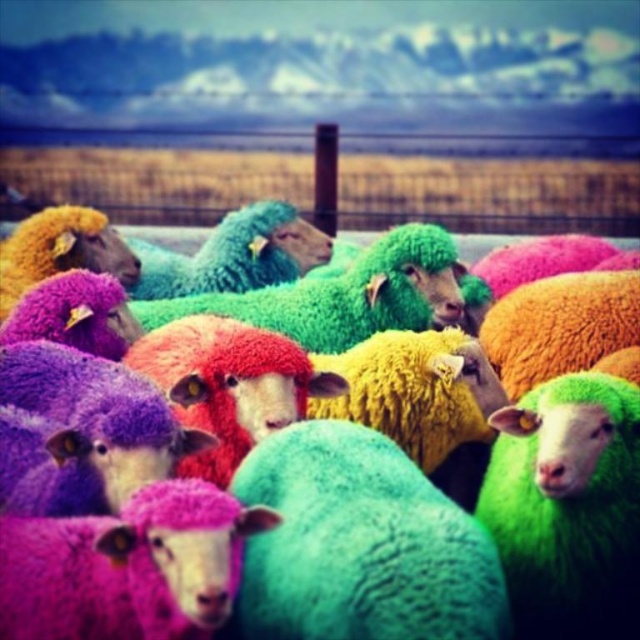
You are standing in a field and see the green fuzzy sheep at center. If you were to walk directly towards the sheep, which direction should you move relative to your current position?

Since the green fuzzy sheep at center is located at point (529, 420) in the 2D space, you should move forward to reach it as it is positioned directly ahead of you in the scene.

You are a photographer standing in the field. You want to take a photo of the green fuzzy sheep at center and the metallic wire fence at upper center. Based on their positions, which object is closer to the camera?

The green fuzzy sheep at center is closer to the camera because it is located below the metallic wire fence at upper center, meaning the fence is in the background while the sheep is in the foreground.

You are a photographer trying to capture the green fuzzy sheep at center and the metallic wire fence at upper center in the same frame. Based on their sizes in the image, which one will appear more prominent in your photo?

The metallic wire fence at upper center will appear more prominent in the photo because it is larger than the green fuzzy sheep at center.